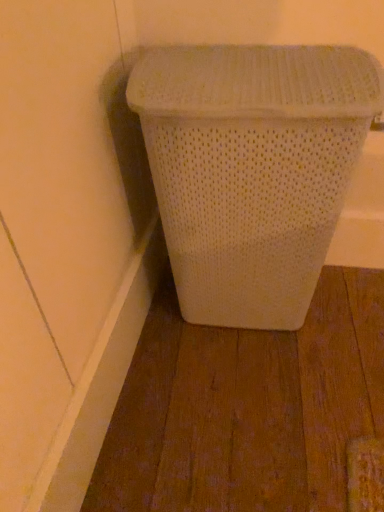
Identify the location of white plastic laundry basket at lower right. (252, 169).

What do you see at coordinates (252, 169) in the screenshot?
I see `white plastic laundry basket at lower right` at bounding box center [252, 169].

Locate an element on the screen. The height and width of the screenshot is (512, 384). white plastic laundry basket at lower right is located at coordinates [x=252, y=169].